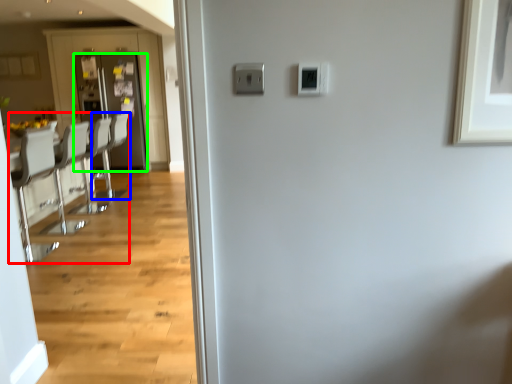
Question: Which object is the farthest from furniture (highlighted by a red box)? Choose among these: armchair (highlighted by a blue box) or door (highlighted by a green box).

Choices:
 (A) armchair
 (B) door

Answer: (B)